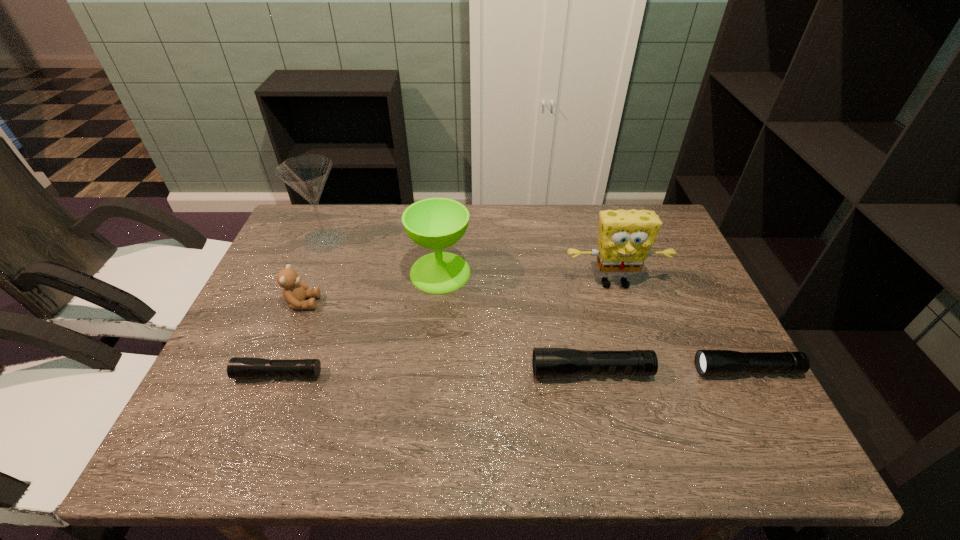
You are a GUI agent. You are given a task and a screenshot of the screen. Output one action in this format:
    pyautogui.click(x=<x>, y=<y>)
    Task: Click on the shortest flashlight
    
    Given the screenshot: What is the action you would take?
    pyautogui.click(x=238, y=367)

The width and height of the screenshot is (960, 540). Identify the location of the leftmost flashlight. (238, 367).

At what (x,y) coordinates should I click in order to perform the action: click on the second flashlight from right to left. Please return your answer as a coordinate pair (x, y). The height and width of the screenshot is (540, 960). Looking at the image, I should click on (547, 362).

This screenshot has height=540, width=960. What are the coordinates of `the rightmost flashlight` in the screenshot? It's located at (708, 362).

Locate an element on the screen. The image size is (960, 540). the second shortest object is located at coordinates (708, 362).

I want to click on wineglass, so click(x=435, y=223).

The height and width of the screenshot is (540, 960). In order to click on flute glass in this screenshot , I will do `click(307, 174)`.

Find the location of a particular element. This screenshot has width=960, height=540. teddy bear is located at coordinates (295, 292).

Image resolution: width=960 pixels, height=540 pixels. I want to click on sponge, so click(625, 239).

Find the location of `vacant region located at the lens end of the second flashlight from left to right`. vacant region located at the lens end of the second flashlight from left to right is located at coordinates (382, 372).